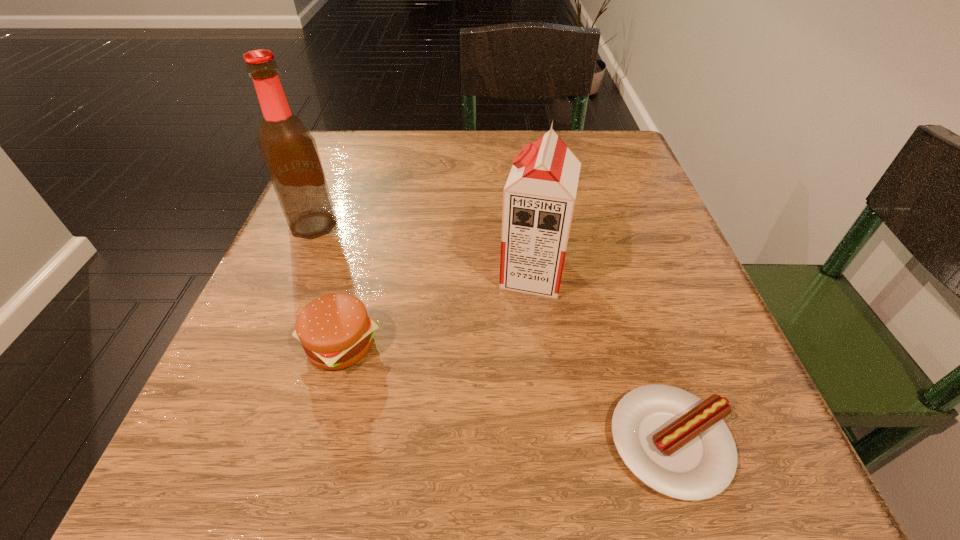
I want to click on beer bottle, so [x=289, y=151].

The image size is (960, 540). Identify the location of the tallest object. (289, 151).

Where is `soya milk`? This screenshot has width=960, height=540. soya milk is located at coordinates (538, 199).

At what (x,y) coordinates should I click in order to perform the action: click on the third nearest object. Please return your answer as a coordinate pair (x, y). This screenshot has height=540, width=960. Looking at the image, I should click on (538, 199).

Where is `the third object from right to left`? Image resolution: width=960 pixels, height=540 pixels. the third object from right to left is located at coordinates (335, 331).

At what (x,y) coordinates should I click in order to perform the action: click on the second shortest object. Please return your answer as a coordinate pair (x, y). This screenshot has width=960, height=540. Looking at the image, I should click on (335, 331).

Image resolution: width=960 pixels, height=540 pixels. In order to click on the rightmost object in this screenshot , I will do `click(677, 444)`.

In order to click on sausage in this screenshot , I will do `click(677, 444)`.

Identify the location of vacant space located 0.400m on the front of the tallest object. (205, 479).

Identify the location of free region located 0.340m on the back of the third shortest object. (517, 150).